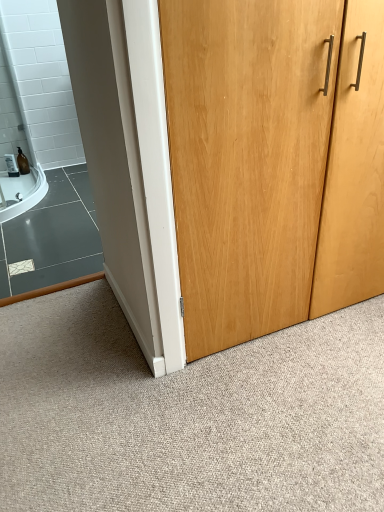
Question: Does light brown wood door at center have a lesser width compared to natural wood door at center?

Choices:
 (A) yes
 (B) no

Answer: (A)

Question: Considering the relative positions of light brown wood door at center and natural wood door at center in the image provided, is light brown wood door at center in front of natural wood door at center?

Choices:
 (A) no
 (B) yes

Answer: (A)

Question: Are light brown wood door at center and natural wood door at center making contact?

Choices:
 (A) yes
 (B) no

Answer: (B)

Question: Is light brown wood door at center facing towards natural wood door at center?

Choices:
 (A) no
 (B) yes

Answer: (A)

Question: Does light brown wood door at center appear on the right side of natural wood door at center?

Choices:
 (A) no
 (B) yes

Answer: (B)

Question: Are light brown wood door at center and natural wood door at center located far from each other?

Choices:
 (A) no
 (B) yes

Answer: (A)

Question: Is there a large distance between natural wood door at center and light brown wood door at center?

Choices:
 (A) no
 (B) yes

Answer: (A)

Question: Is natural wood door at center bigger than light brown wood door at center?

Choices:
 (A) no
 (B) yes

Answer: (B)

Question: From a real-world perspective, is natural wood door at center physically above light brown wood door at center?

Choices:
 (A) yes
 (B) no

Answer: (B)

Question: Considering the relative sizes of natural wood door at center and light brown wood door at center in the image provided, is natural wood door at center smaller than light brown wood door at center?

Choices:
 (A) no
 (B) yes

Answer: (A)

Question: Is natural wood door at center aimed at light brown wood door at center?

Choices:
 (A) yes
 (B) no

Answer: (A)

Question: Is natural wood door at center behind light brown wood door at center?

Choices:
 (A) yes
 (B) no

Answer: (B)

Question: Is natural wood door at center inside or outside of light brown wood door at center?

Choices:
 (A) inside
 (B) outside

Answer: (B)